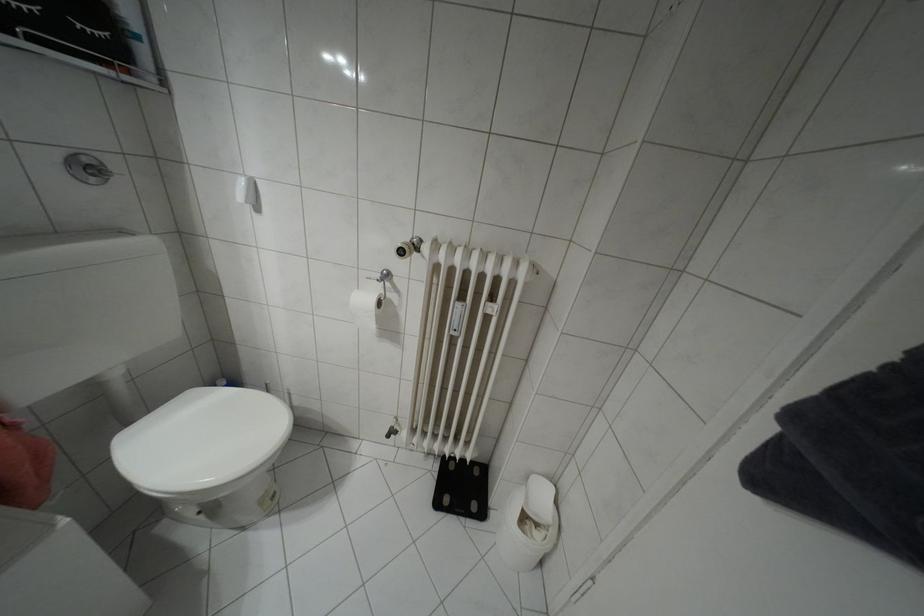
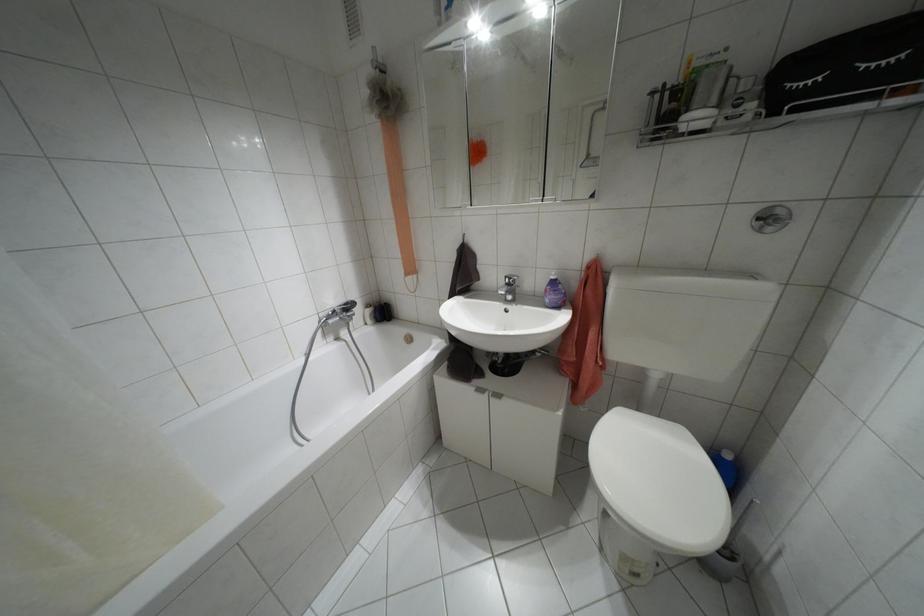
In the second image, find the point that corresponds to point 92,179 in the first image.

(769, 228)